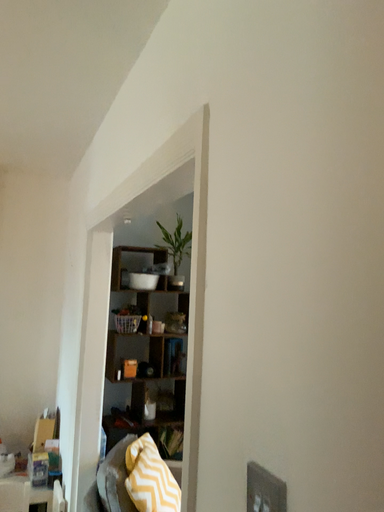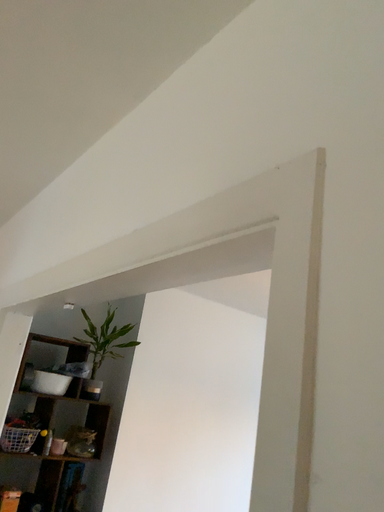
Question: Which way did the camera rotate in the video?

Choices:
 (A) rotated left
 (B) rotated right

Answer: (B)